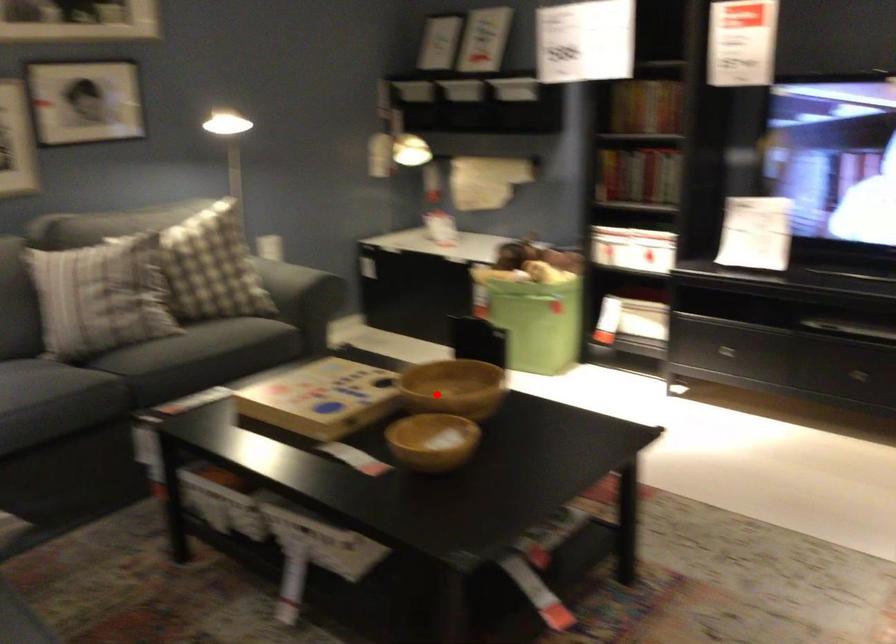
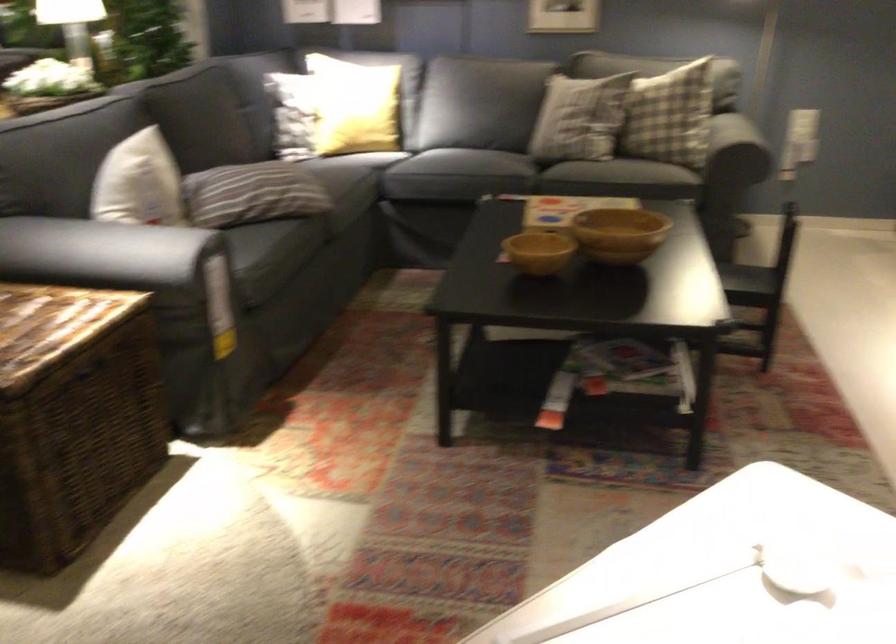
Find the pixel in the second image that matches the highlighted location in the first image.

(618, 234)